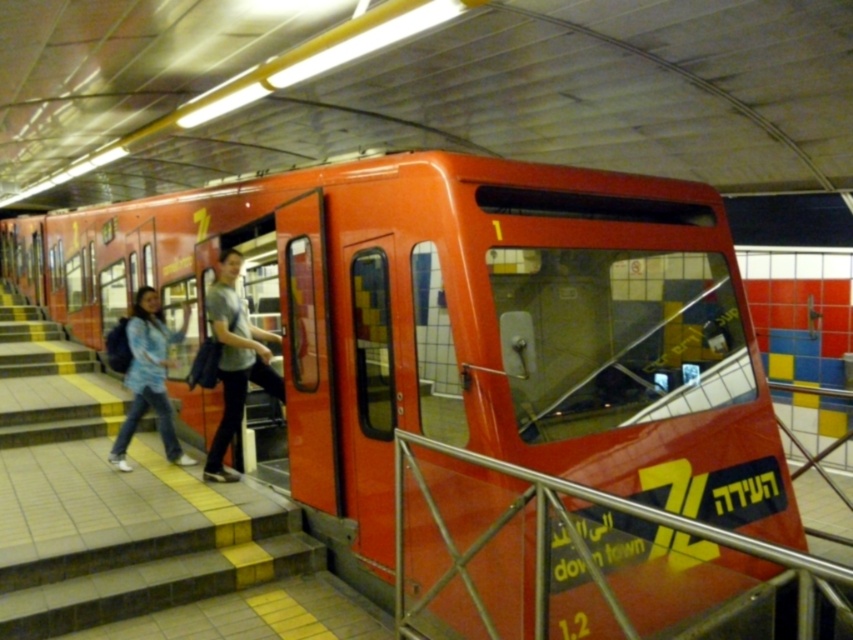
Question: Does metallic red train at center have a greater width compared to blue denim jacket at left?

Choices:
 (A) no
 (B) yes

Answer: (B)

Question: Does metallic silver rail at lower right appear on the left side of blue denim jacket at left?

Choices:
 (A) yes
 (B) no

Answer: (B)

Question: Which is nearer to the metallic silver rail at lower right?

Choices:
 (A) blue denim jacket at left
 (B) gray cotton shirt at center

Answer: (B)

Question: Which point is farther to the camera?

Choices:
 (A) (160, 339)
 (B) (537, 472)
 (C) (496, 413)
 (D) (215, 368)

Answer: (A)

Question: Among these points, which one is nearest to the camera?

Choices:
 (A) (163, 378)
 (B) (566, 529)
 (C) (595, 460)

Answer: (B)

Question: Does metallic silver rail at lower right appear under blue denim jacket at left?

Choices:
 (A) no
 (B) yes

Answer: (B)